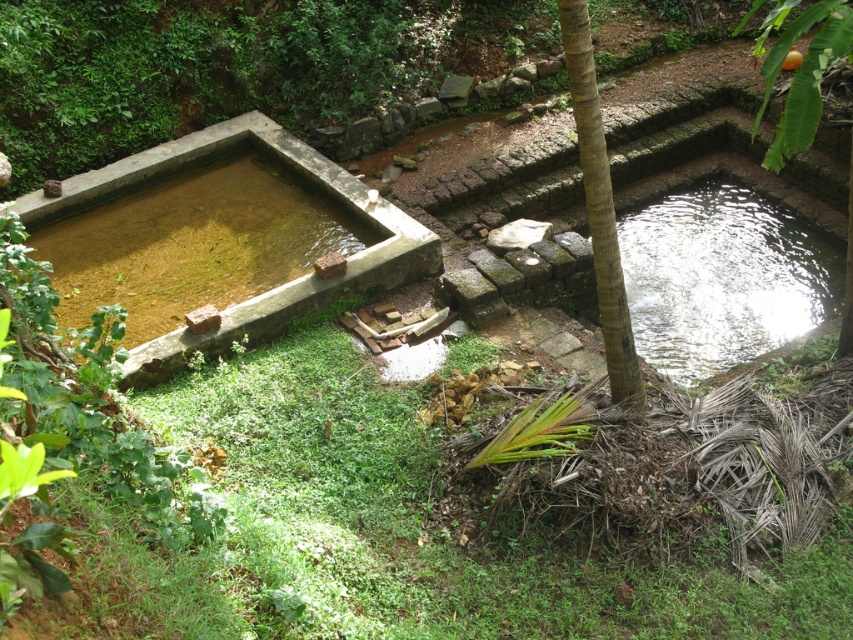
You are a gardener planning to place a decorative stone statue in the center of the scene. The statue requires a base that must be wider than the green grass at center and taller than the brown rough tree trunk at center. Can the statue be placed there based on the scene description?

The green grass at center has a larger width than the brown rough tree trunk at center. However, the statue requires a base wider than the grass and taller than the tree trunk. Since the grass is already wider than the tree trunk, the base must exceed the grass width, which is possible, but the height requirement must also be met. However, the description only provides width comparison between the two objects, not their heights. Therefore, it is unclear if the statue can be placed there as the height of the

You are standing at the edge of the deeper pond on the right and want to place a small decorative rock at point (692,532) and point (619,344). Which point should you aim for if you want the rock to be closer to the viewer?

You should aim for point (692,532) because it is closer to the viewer than point (619,344).